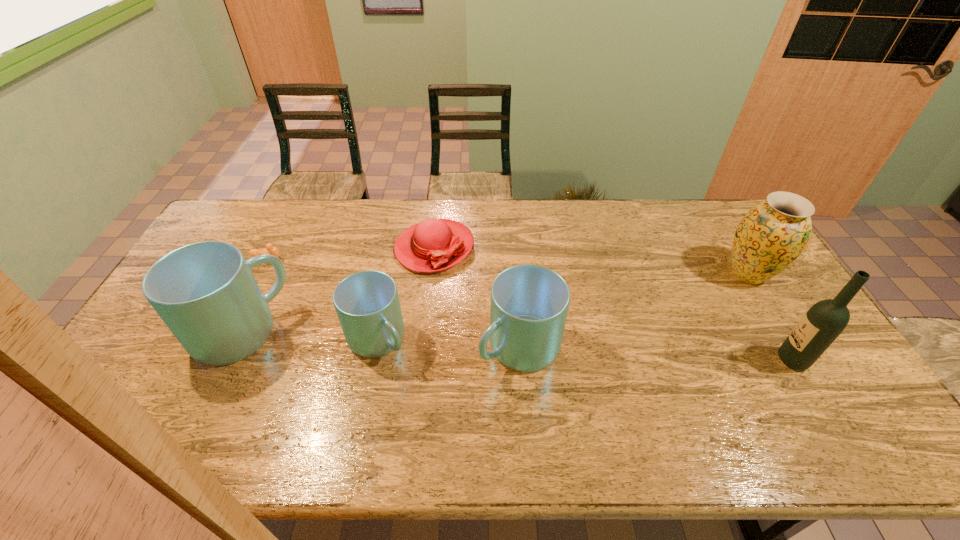
Please point a spot to add another mug on the right. Please provide its 2D coordinates. Your answer should be formatted as a tuple, i.e. [(x, y)], where the tuple contains the x and y coordinates of a point satisfying the conditions above.

[(665, 355)]